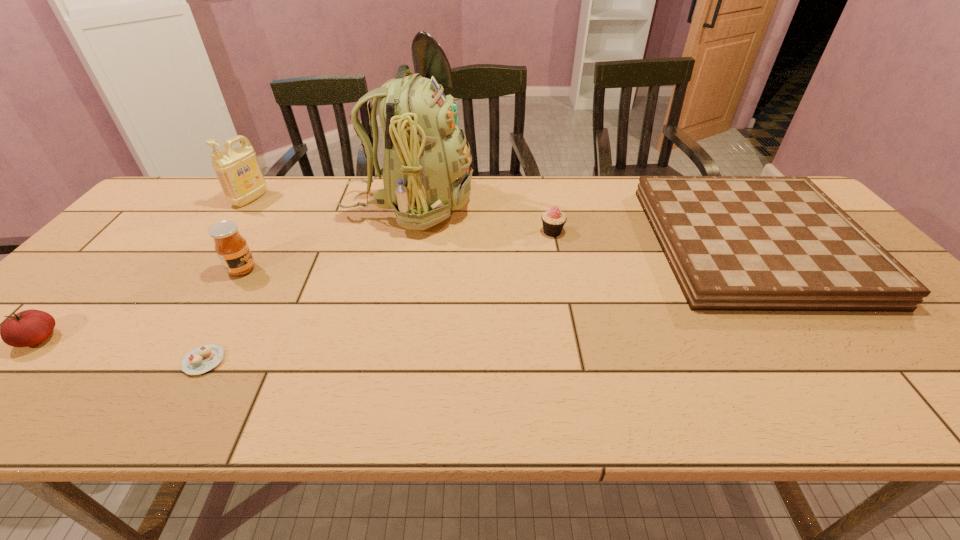
Locate an element on the screen. This screenshot has width=960, height=540. detergent that is at the far edge is located at coordinates (238, 171).

I want to click on gameboard positioned at the far edge, so click(x=734, y=243).

The width and height of the screenshot is (960, 540). I want to click on object that is at the left edge, so click(x=30, y=327).

The image size is (960, 540). Identify the location of object positioned at the right edge. (734, 243).

Identify the location of object situated at the far right corner. The height and width of the screenshot is (540, 960). (734, 243).

Locate an element on the screen. This screenshot has width=960, height=540. vacant area at the far edge is located at coordinates (612, 211).

Identify the location of free space at the near edge. This screenshot has height=540, width=960. (757, 382).

At what (x,y) coordinates should I click in order to perform the action: click on vacant space at the left edge. Please return your answer as a coordinate pair (x, y). Looking at the image, I should click on (128, 240).

Identify the location of free spot between the leftmost object and the detergent. (144, 269).

At what (x,y) coordinates should I click in order to perform the action: click on vacant point located between the farther cupcake and the third object from right to left. Please return your answer as a coordinate pair (x, y). Looking at the image, I should click on (481, 219).